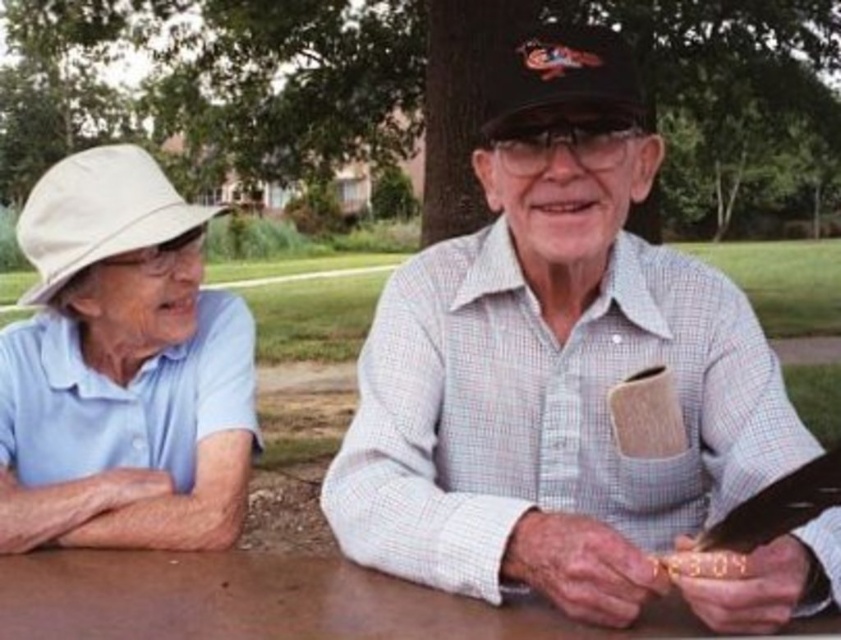
Question: Among these objects, which one is farthest from the camera?

Choices:
 (A) black textured baseball cap at center
 (B) brown wooden table at center
 (C) white checkered shirt at center
 (D) white fabric baseball hat at left

Answer: (D)

Question: Can you confirm if brown wooden table at center is bigger than black textured baseball cap at center?

Choices:
 (A) yes
 (B) no

Answer: (A)

Question: Which of the following is the farthest from the observer?

Choices:
 (A) (172, 525)
 (B) (167, 568)
 (C) (194, 221)

Answer: (C)

Question: Can you confirm if white fabric baseball hat at left is thinner than black textured baseball cap at center?

Choices:
 (A) yes
 (B) no

Answer: (B)

Question: Does white fabric hat at left come behind brown wooden table at center?

Choices:
 (A) yes
 (B) no

Answer: (A)

Question: Which point is farther to the camera?

Choices:
 (A) (155, 205)
 (B) (86, 204)
 (C) (279, 605)
 (D) (562, 22)

Answer: (D)